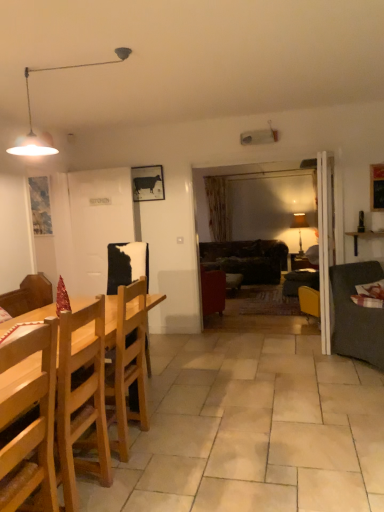
Identify the location of free point above metallic pendant light at upper left, the first lamp viewed from the left (from a real-world perspective). This screenshot has height=512, width=384. (66, 62).